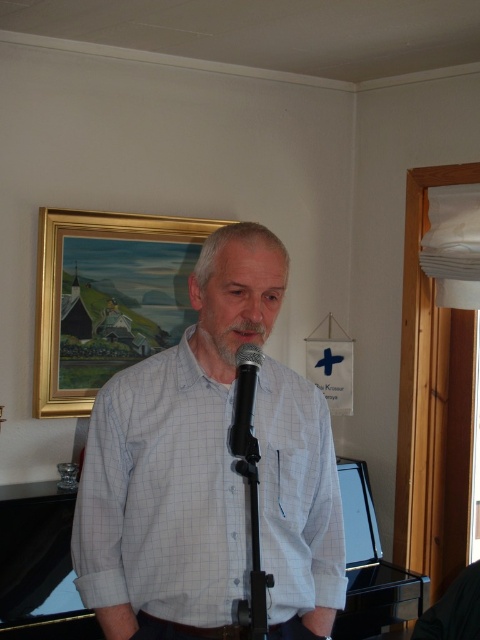
Question: Is gold-framed painting at upper center to the left of black metallic microphone at center from the viewer's perspective?

Choices:
 (A) yes
 (B) no

Answer: (A)

Question: Can you confirm if white checkered shirt at center is positioned below gold-framed painting at upper center?

Choices:
 (A) yes
 (B) no

Answer: (A)

Question: Which point is closer to the camera taking this photo?

Choices:
 (A) (52, 340)
 (B) (243, 417)

Answer: (B)

Question: Does gold-framed painting at upper center have a greater width compared to black metallic microphone at center?

Choices:
 (A) no
 (B) yes

Answer: (B)

Question: Among these objects, which one is farthest from the camera?

Choices:
 (A) white checkered shirt at center
 (B) gold-framed painting at upper center

Answer: (B)

Question: Which point is closer to the camera?

Choices:
 (A) (x=241, y=518)
 (B) (x=156, y=346)

Answer: (A)